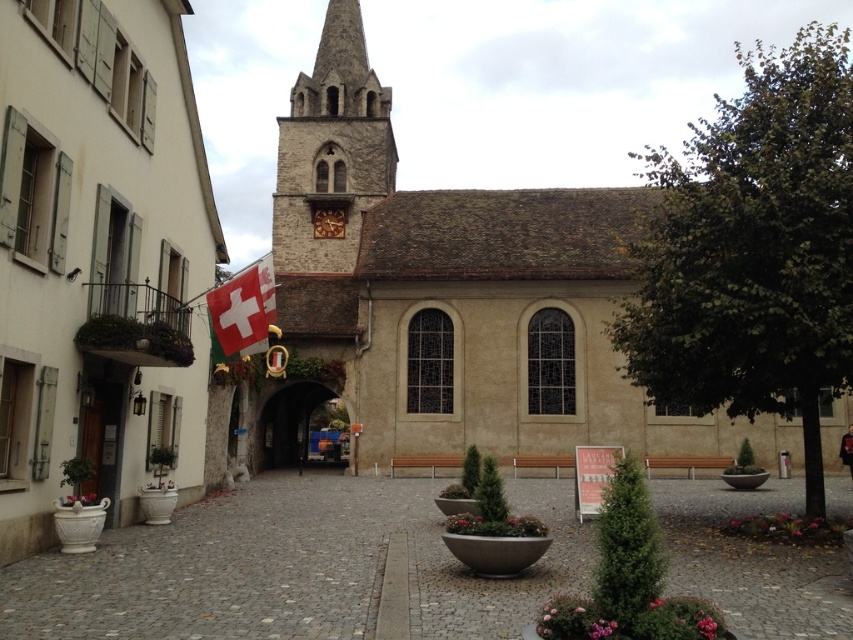
You are standing at the entrance of the churchyard and see the gray cobblestone alley at center and the white fabric flag at lower left. Which object is positioned to the right of the other?

The gray cobblestone alley at center is positioned to the right of the white fabric flag at lower left.